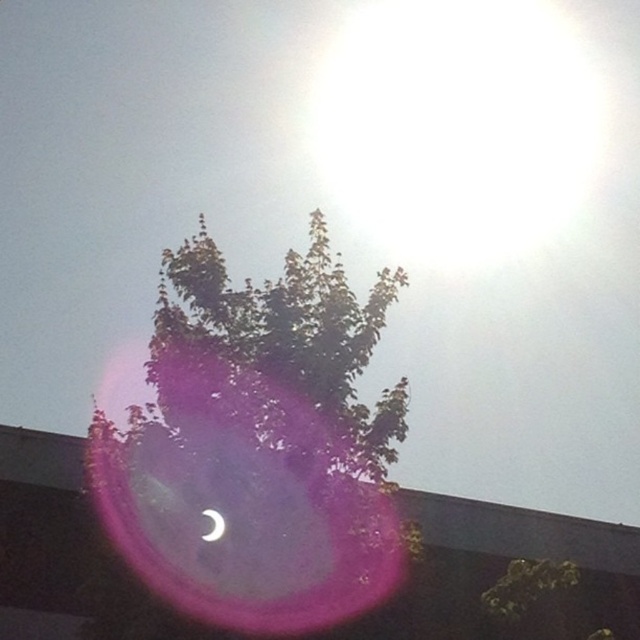
Is green leafy tree at center bigger than satin white crescent at upper center?

Yes, green leafy tree at center is bigger than satin white crescent at upper center.

Can you confirm if green leafy tree at center is shorter than satin white crescent at upper center?

In fact, green leafy tree at center may be taller than satin white crescent at upper center.

Between point (182, 433) and point (218, 524), which one is positioned behind?

Point (182, 433)

Locate an element on the screen. The width and height of the screenshot is (640, 640). green leafy tree at center is located at coordinates (257, 445).

Is point (544, 138) positioned behind point (218, 515)?

Yes, point (544, 138) is behind point (218, 515).

Who is higher up, bright white disk at upper center or satin white crescent at upper center?

bright white disk at upper center is above.

The height and width of the screenshot is (640, 640). Find the location of `bright white disk at upper center`. bright white disk at upper center is located at coordinates (460, 124).

Does green leafy tree at center have a lesser height compared to bright white disk at upper center?

In fact, green leafy tree at center may be taller than bright white disk at upper center.

Between green leafy tree at center and bright white disk at upper center, which one appears on the left side from the viewer's perspective?

green leafy tree at center is more to the left.

Is point (124, 497) more distant than point (387, 141)?

No, it is not.

The image size is (640, 640). Identify the location of green leafy tree at center. (257, 445).